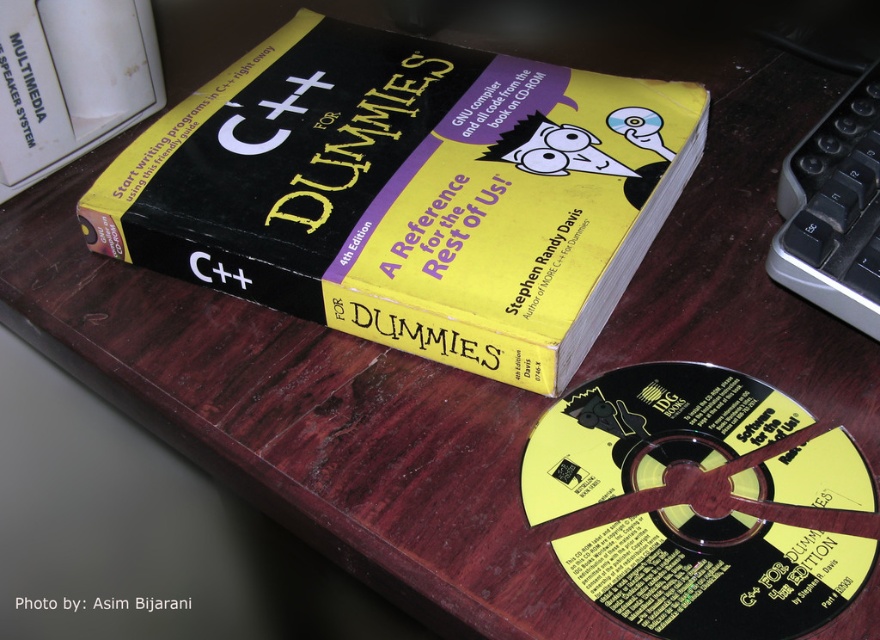
At what (x,y) coordinates should I click in order to perform the action: click on black matte book at center. Please return your answer as a coordinate pair (x, y). Looking at the image, I should click on (408, 193).

Between black matte book at center and black plastic cd at lower right, which one appears on the right side from the viewer's perspective?

From the viewer's perspective, black plastic cd at lower right appears more on the right side.

Is point (490, 342) more distant than point (682, 369)?

No, (490, 342) is closer to viewer.

You are a GUI agent. You are given a task and a screenshot of the screen. Output one action in this format:
    pyautogui.click(x=<x>, y=<y>)
    Task: Click on the black matte book at center
    The image size is (880, 640).
    Given the screenshot: What is the action you would take?
    pyautogui.click(x=408, y=193)